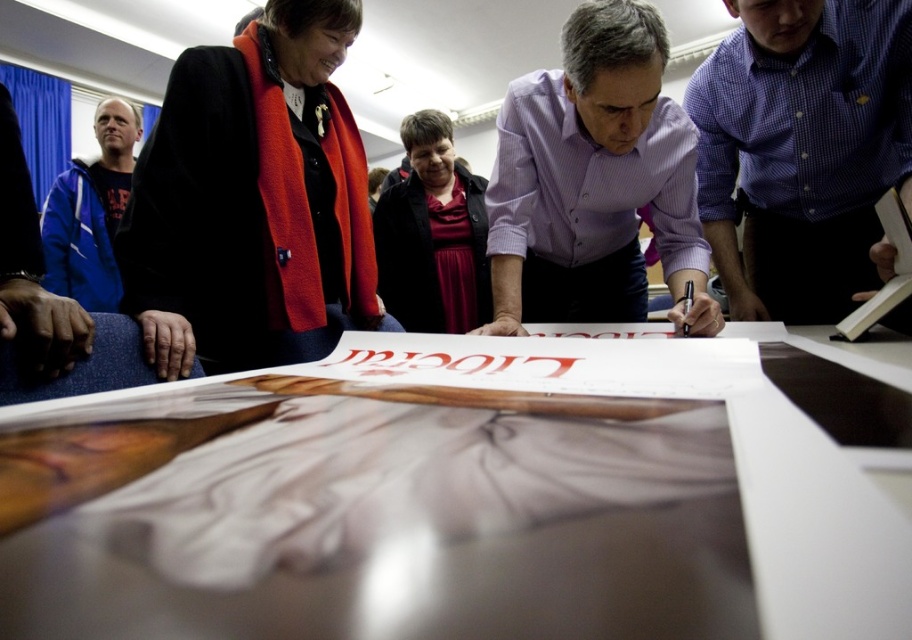
You are a photographer at the signing event and need to adjust your camera angle to capture both the blue fleece jacket at left and the black paper at center clearly. Based on their heights, which object should you focus on first to ensure proper framing?

The blue fleece jacket at left is taller than the black paper at center, so you should focus on the blue fleece jacket at left first to ensure proper framing.

You are a photographer at the signing event and need to adjust the lighting so that both the black woolen coat at upper left and the blue fleece jacket at left are well lit. Which one should you focus the light on first to ensure the closer item is properly illuminated?

The black woolen coat at upper left is closer to the viewer than the blue fleece jacket at left, so you should focus the light on the black woolen coat at upper left first to ensure proper illumination before adjusting for the other.

You are a photographer setting up a tripod to capture the scene. The tripod requires a minimum of 1 meter between the black woolen coat at upper left and the blue fleece jacket at left to fit properly. Based on the scene description, can you determine if there is enough space between them?

The description states that the black woolen coat at upper left might be wider than blue fleece jacket at left, but there is no specific measurement provided about the distance between them. Therefore, it is unclear if the tripod will fit within the required 1 meter space between the two objects.